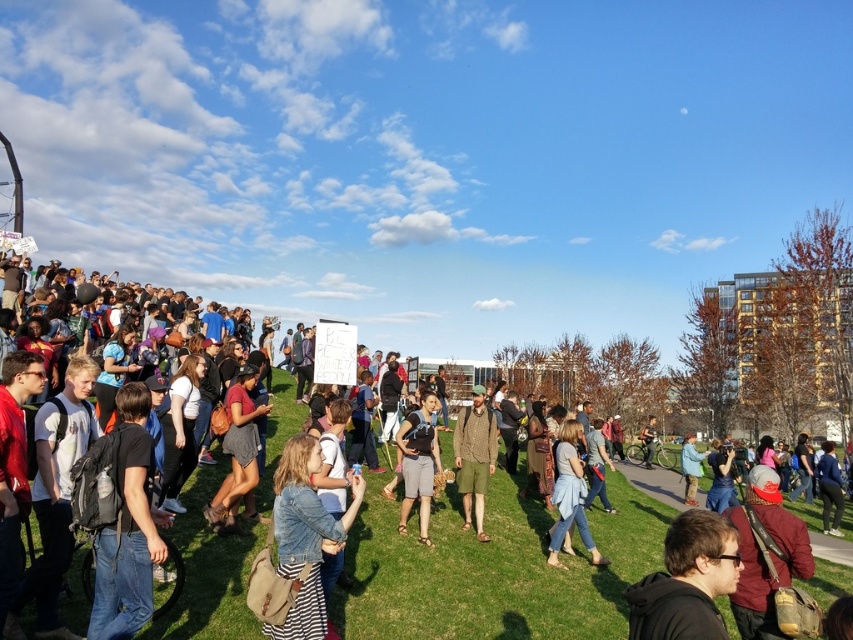
Between denim jacket at center and denim jacket at lower center, which one appears on the left side from the viewer's perspective?

denim jacket at center is more to the left.

The width and height of the screenshot is (853, 640). Describe the element at coordinates (305, 536) in the screenshot. I see `denim jacket at center` at that location.

I want to click on denim jacket at center, so click(x=305, y=536).

Is matte black backpack at center smaller than denim jacket at lower center?

Yes.

Does matte black backpack at center appear on the right side of denim jacket at lower center?

In fact, matte black backpack at center is to the left of denim jacket at lower center.

What do you see at coordinates (418, 464) in the screenshot? Image resolution: width=853 pixels, height=640 pixels. I see `matte black backpack at center` at bounding box center [418, 464].

Where is `matte black backpack at center`? matte black backpack at center is located at coordinates (418, 464).

What do you see at coordinates (305, 536) in the screenshot? This screenshot has width=853, height=640. I see `denim jacket at center` at bounding box center [305, 536].

Is point (310, 438) positioned after point (456, 456)?

No, it is in front of (456, 456).

Who is more distant from viewer, (316, 513) or (480, 444)?

Positioned behind is point (480, 444).

At what (x,y) coordinates should I click in order to perform the action: click on denim jacket at center. Please return your answer as a coordinate pair (x, y). The image size is (853, 640). Looking at the image, I should click on (305, 536).